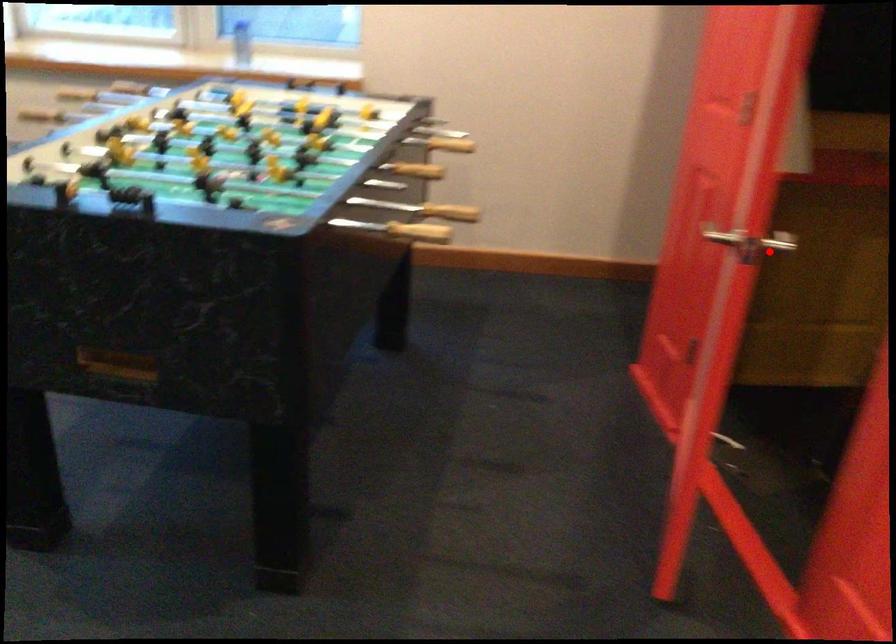
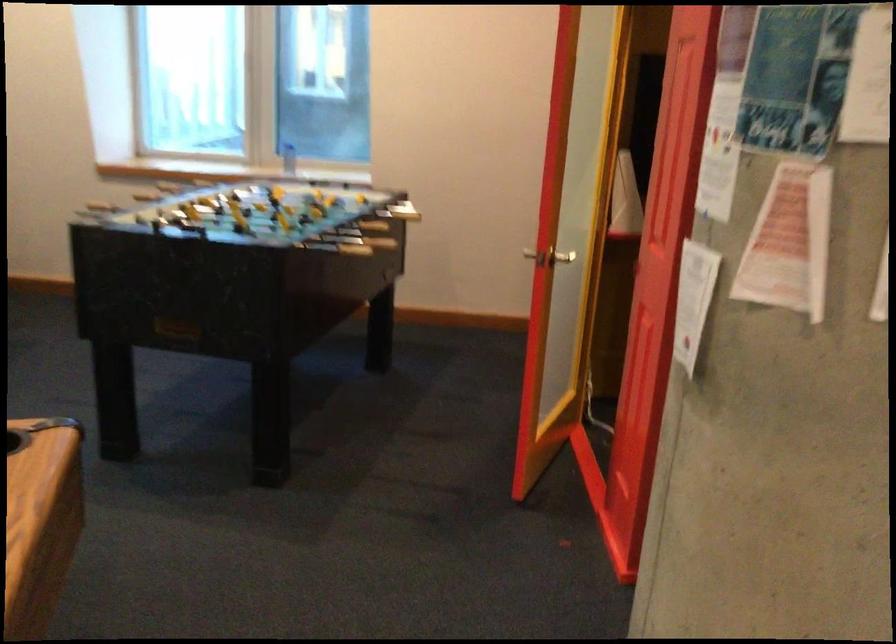
Question: I am providing you with two images of the same scene from different viewpoints. Image1 has a red point marked. In image2, the corresponding 3D location appears at what relative position? Reply with the corresponding letter.

Choices:
 (A) Closer
 (B) Farther

Answer: (B)